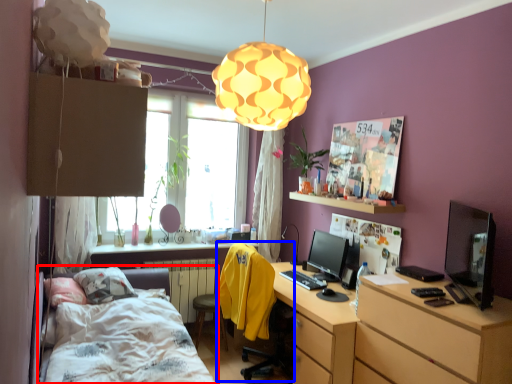
Question: Which point is further to the camera, bed (highlighted by a red box) or computer chair (highlighted by a blue box)?

Choices:
 (A) bed
 (B) computer chair

Answer: (B)